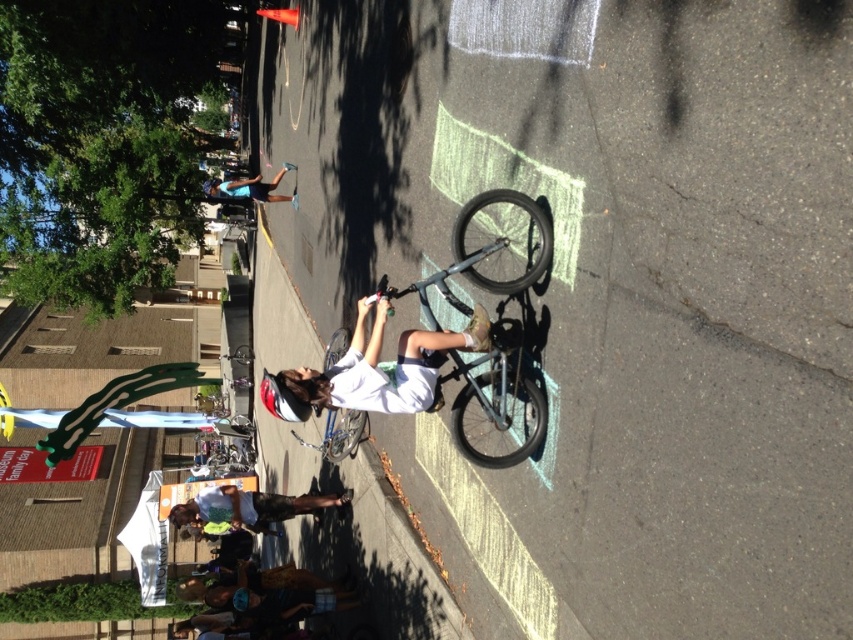
You are a photographer positioned at the edge of the chalk drawings. You want to take a photo of the white matte shirt at center and the shiny metallic bicycle at center such that the shirt appears to the right of the bicycle in the photo. Is this possible given their current positions?

The white matte shirt at center is currently to the left of the shiny metallic bicycle at center. To have the shirt appear to the right of the bicycle in the photo, you would need to adjust your position or the subjects, which isn t possible with their current arrangement. Therefore, it isn t possible.

You are standing at the center of the image and want to locate the white matte shirt at center. Which direction should you look to find it?

You should look directly ahead since the white matte shirt at center is located at the center of the image at point coordinates (380, 369).